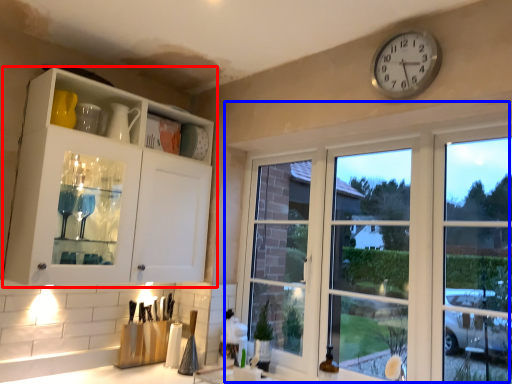
Question: Which object appears closest to the camera in this image, cabinetry (highlighted by a red box) or window (highlighted by a blue box)?

Choices:
 (A) cabinetry
 (B) window

Answer: (B)